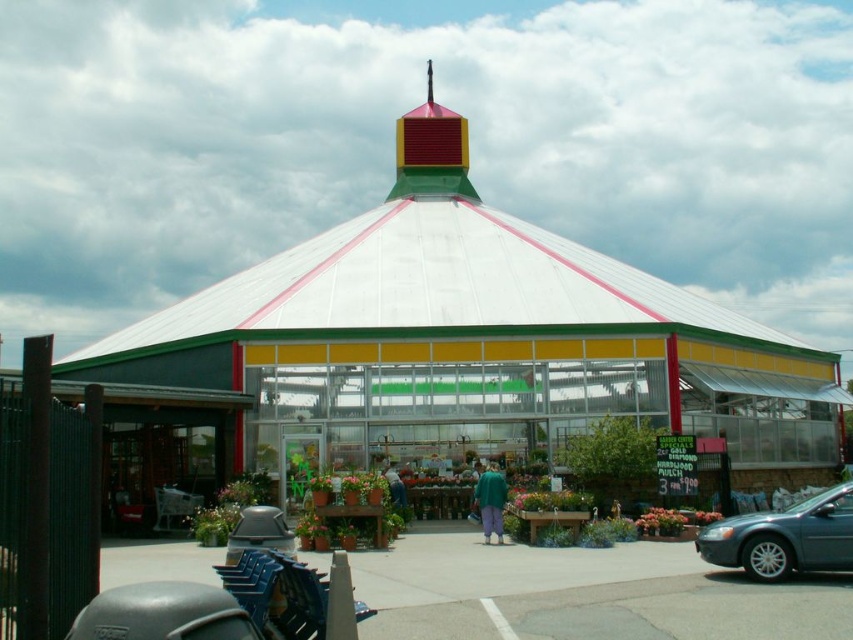
Question: Which of these objects is positioned closest to the transparent glass greenhouse at center?

Choices:
 (A) metallic gray sedan at lower right
 (B) green matte pants at center

Answer: (B)

Question: Does metallic gray sedan at lower right appear under green matte pants at center?

Choices:
 (A) yes
 (B) no

Answer: (B)

Question: Does transparent glass greenhouse at center have a smaller size compared to metallic gray sedan at lower right?

Choices:
 (A) no
 (B) yes

Answer: (A)

Question: Which is nearer to the metallic gray sedan at lower right?

Choices:
 (A) green matte pants at center
 (B) transparent glass greenhouse at center

Answer: (A)

Question: Where is metallic gray sedan at lower right located in relation to green matte pants at center in the image?

Choices:
 (A) left
 (B) right

Answer: (B)

Question: Which point is closer to the camera?

Choices:
 (A) (711, 531)
 (B) (363, 276)

Answer: (A)